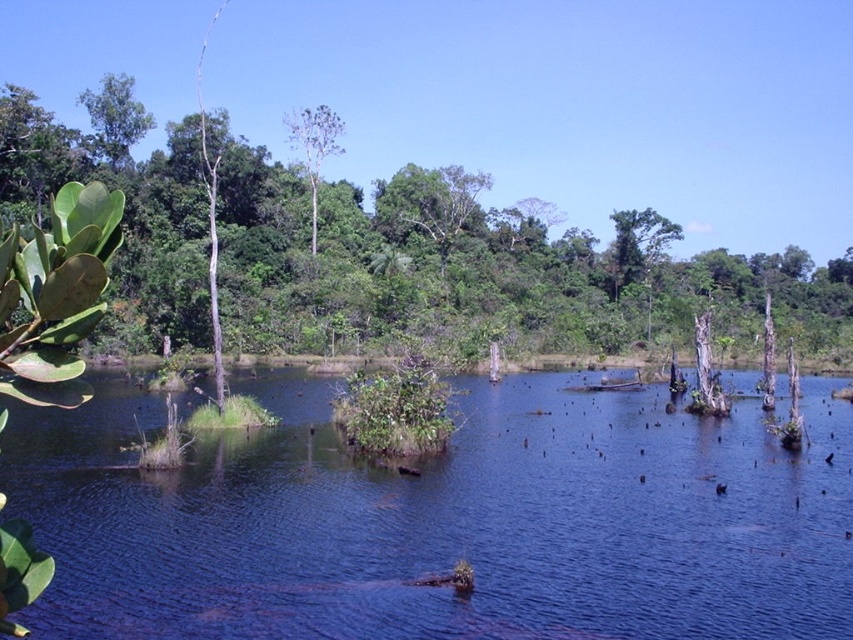
Question: Which point is closer to the camera taking this photo?

Choices:
 (A) (634, 236)
 (B) (846, 305)
 (C) (318, 157)

Answer: (A)

Question: Is green leafy tree at upper center positioned at the back of green leafy tree at center?

Choices:
 (A) yes
 (B) no

Answer: (A)

Question: Which object is farther from the camera taking this photo?

Choices:
 (A) blue water at center
 (B) green leafy tree at upper center
 (C) green leafy tree at left

Answer: (B)

Question: Considering the relative positions of blue water at center and green leafy tree at upper center in the image provided, where is blue water at center located with respect to green leafy tree at upper center?

Choices:
 (A) below
 (B) above

Answer: (A)

Question: Which object appears closest to the camera in this image?

Choices:
 (A) green leafy tree at left
 (B) green leafy tree at upper center
 (C) green leafy tree at center
 (D) blue water at center

Answer: (D)

Question: Can you confirm if blue water at center is smaller than green leafy tree at center?

Choices:
 (A) yes
 (B) no

Answer: (A)